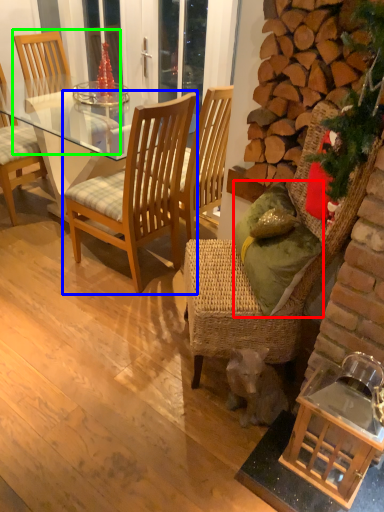
Question: Which is farther away from pillow (highlighted by a red box)? chair (highlighted by a blue box) or chair (highlighted by a green box)?

Choices:
 (A) chair
 (B) chair

Answer: (B)